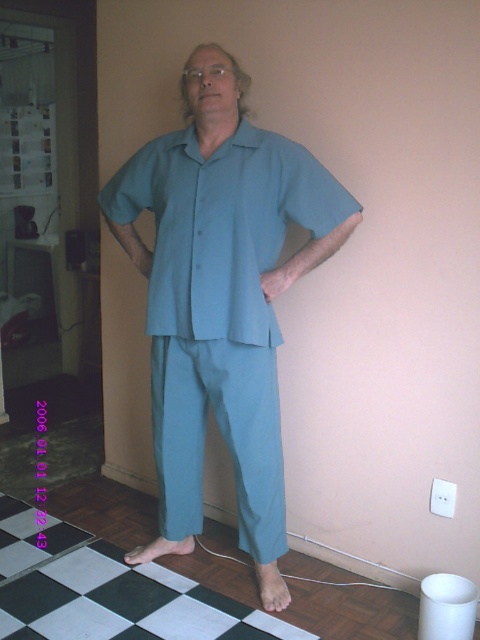
You are standing at point (x=178, y=257) and want to walk to point (x=227, y=256). Which direction should you move?

You should move forward because point (x=227, y=256) is in front of point (x=178, y=257).

You are helping someone get dressed and notice they have two teal tops to choose from. The teal cotton pajamas at center and the teal smooth shirt at center. Which one is currently covering the other?

The teal cotton pajamas at center is positioned under the teal smooth shirt at center, so the shirt is covering the pajamas.